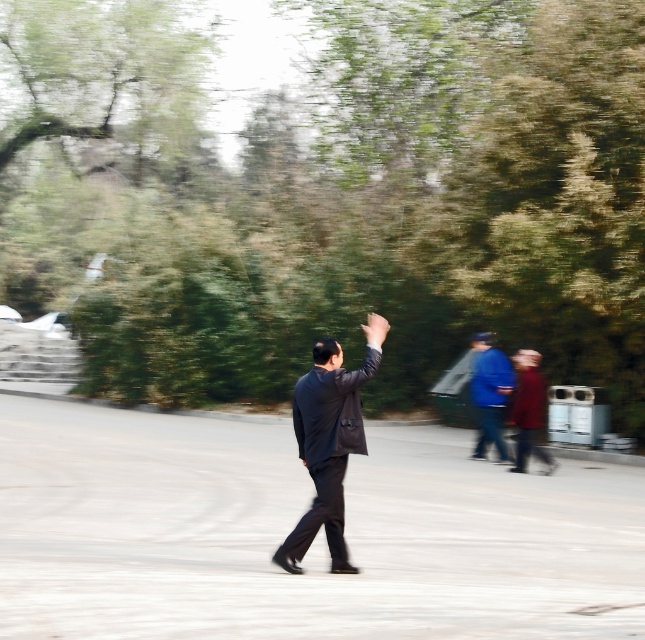
Question: Does dark blue suit at center have a smaller size compared to blue fabric jacket at center-right?

Choices:
 (A) yes
 (B) no

Answer: (B)

Question: Which point is farther to the camera?

Choices:
 (A) tap(324, 403)
 (B) tap(475, 456)

Answer: (B)

Question: Among these objects, which one is nearest to the camera?

Choices:
 (A) blue fabric jacket at center-right
 (B) dark blue suit at center

Answer: (B)

Question: Is dark blue suit at center positioned in front of blue fabric jacket at center-right?

Choices:
 (A) no
 (B) yes

Answer: (B)

Question: Can you confirm if dark blue suit at center is positioned below blue fabric jacket at center-right?

Choices:
 (A) yes
 (B) no

Answer: (B)